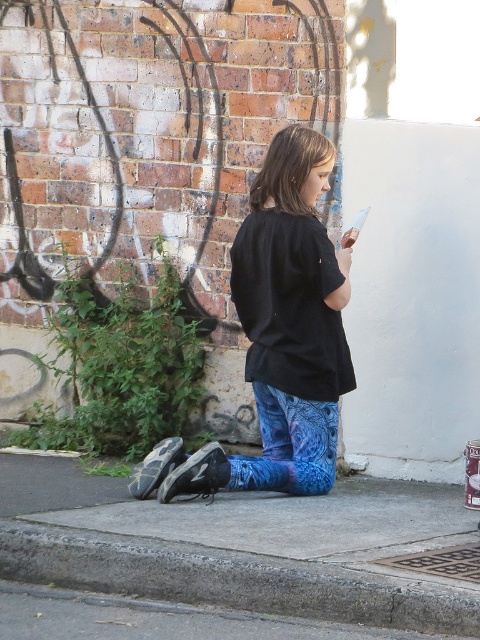
Question: Does gray concrete curb at lower left appear over blue printed leggings at lower center?

Choices:
 (A) yes
 (B) no

Answer: (B)

Question: Which object is the closest to the gray concrete curb at lower left?

Choices:
 (A) black cotton shirt at center
 (B) blue printed leggings at lower center

Answer: (B)

Question: Observing the image, what is the correct spatial positioning of black cotton shirt at center in reference to blue printed leggings at lower center?

Choices:
 (A) right
 (B) left

Answer: (B)

Question: Is the position of black cotton shirt at center more distant than that of gray concrete curb at lower left?

Choices:
 (A) yes
 (B) no

Answer: (A)

Question: Which point is closer to the camera taking this photo?

Choices:
 (A) (173, 493)
 (B) (196, 588)

Answer: (B)

Question: Which object is closer to the camera taking this photo?

Choices:
 (A) black cotton shirt at center
 (B) blue printed leggings at lower center

Answer: (A)